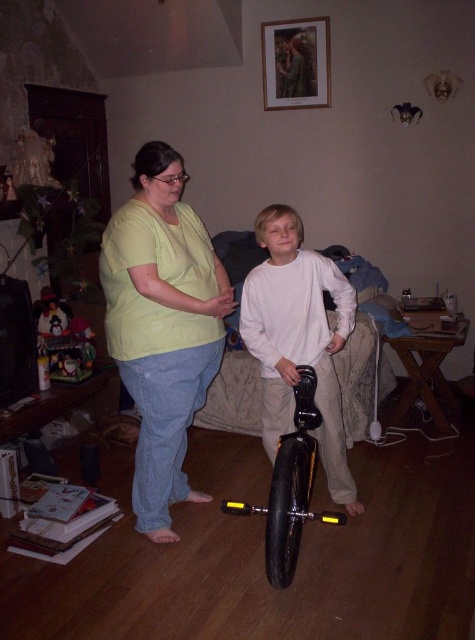
Question: Which of the following is the farthest from the observer?

Choices:
 (A) (141, 192)
 (B) (259, 298)

Answer: (B)

Question: Which of the following is the farthest from the observer?

Choices:
 (A) (310, 253)
 (B) (190, 230)
 (C) (335, 524)

Answer: (A)

Question: Can you confirm if light green t-shirt at center is bigger than white matte unicycle at center?

Choices:
 (A) no
 (B) yes

Answer: (B)

Question: Does white matte unicycle at center have a larger size compared to black rubber monocycle at center?

Choices:
 (A) yes
 (B) no

Answer: (A)

Question: Which point appears farthest from the camera in this image?

Choices:
 (A) (274, 538)
 (B) (321, 442)

Answer: (B)

Question: Is light green t-shirt at center wider than white matte unicycle at center?

Choices:
 (A) yes
 (B) no

Answer: (B)